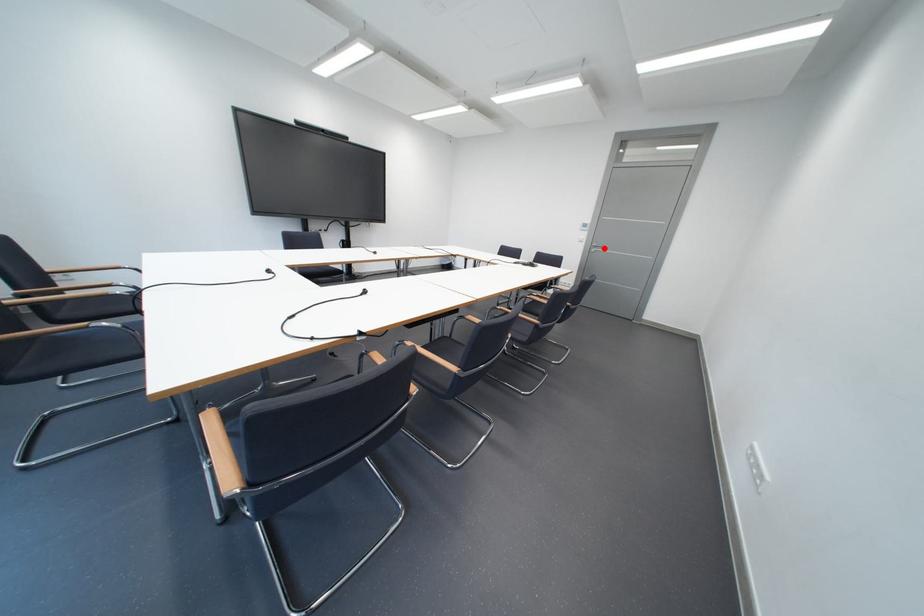
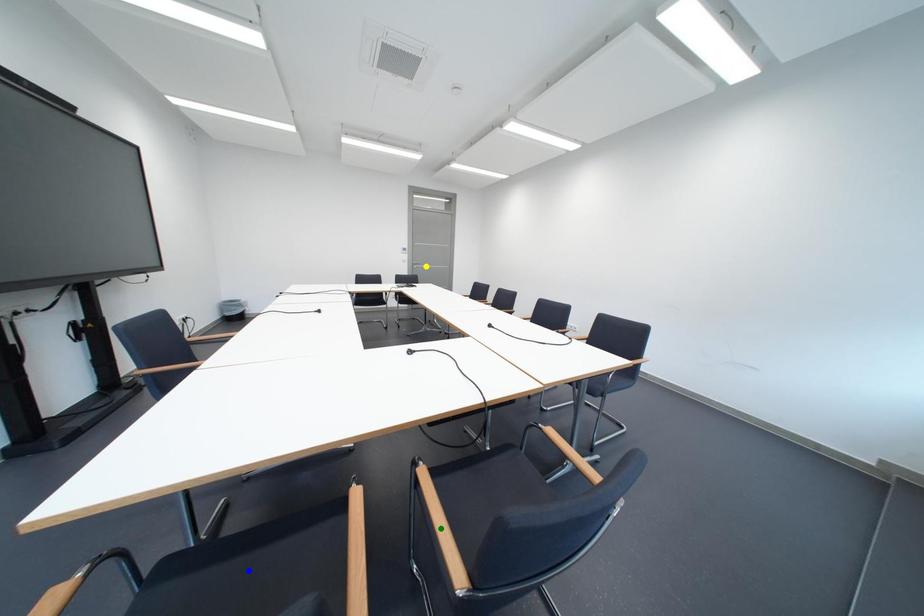
Question: I am providing you with two images of the same scene from different viewpoints. A red point is marked on the first image. You are given multiple points on the second image. Which mark in image 2 goes with the point in image 1?

Choices:
 (A) green point
 (B) blue point
 (C) yellow point

Answer: (C)